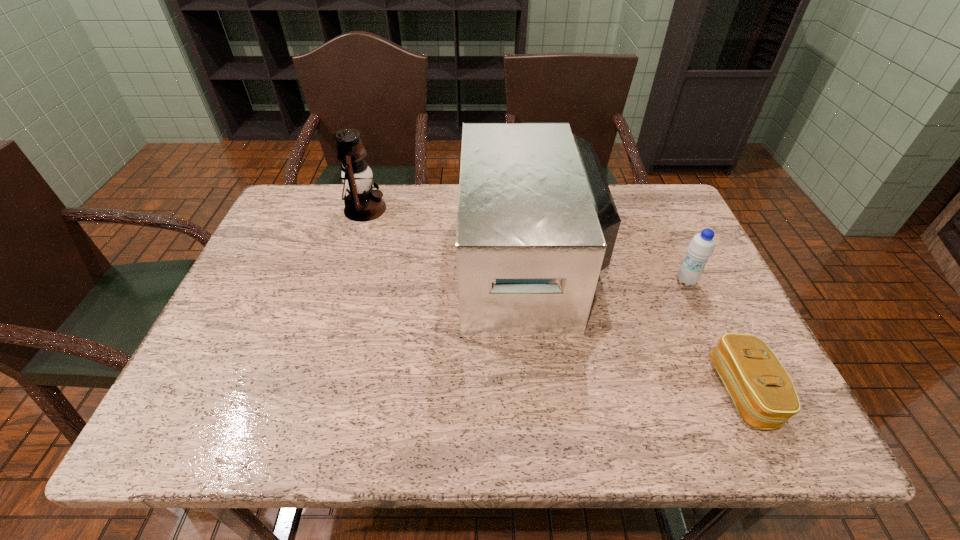
Locate an element on the screen. This screenshot has height=540, width=960. free spot located 0.160m on the zipper side of the shortest object is located at coordinates (638, 392).

Where is `blank space located 0.270m on the zipper side of the shortest object`? blank space located 0.270m on the zipper side of the shortest object is located at coordinates (584, 392).

Where is `free space located on the zipper side of the shortest object`? Image resolution: width=960 pixels, height=540 pixels. free space located on the zipper side of the shortest object is located at coordinates (549, 392).

Image resolution: width=960 pixels, height=540 pixels. Identify the location of lantern that is at the far edge. (362, 203).

Identify the location of microwave oven located at the far edge. (536, 223).

Locate an element on the screen. The height and width of the screenshot is (540, 960). object that is at the near edge is located at coordinates (762, 391).

You are a GUI agent. You are given a task and a screenshot of the screen. Output one action in this format:
    pyautogui.click(x=<x>, y=<y>)
    Task: Click on the water bottle present at the right edge
    
    Given the screenshot: What is the action you would take?
    pos(701,247)

At what (x,y) coordinates should I click in order to perform the action: click on clutch bag that is at the right edge. Please return your answer as a coordinate pair (x, y). This screenshot has height=540, width=960. Looking at the image, I should click on (762, 391).

You are a GUI agent. You are given a task and a screenshot of the screen. Output one action in this format:
    pyautogui.click(x=<x>, y=<y>)
    Task: Click on the object that is at the near right corner
    This screenshot has height=540, width=960.
    Given the screenshot: What is the action you would take?
    pyautogui.click(x=762, y=391)

This screenshot has width=960, height=540. Identify the location of vacant area at the far edge. 618,209.